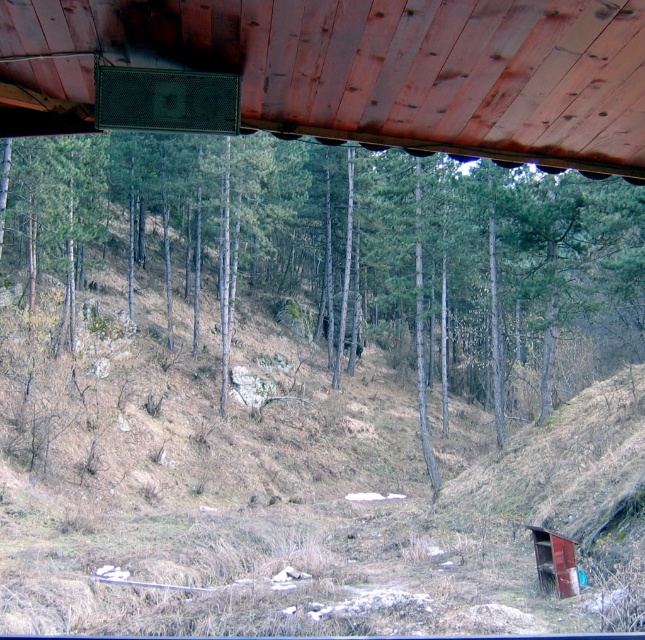
Can you confirm if green leafy tree at center is taller than wooden ceiling at upper center?

Yes, green leafy tree at center is taller than wooden ceiling at upper center.

The height and width of the screenshot is (640, 645). What do you see at coordinates (352, 248) in the screenshot?
I see `green leafy tree at center` at bounding box center [352, 248].

I want to click on green leafy tree at center, so click(352, 248).